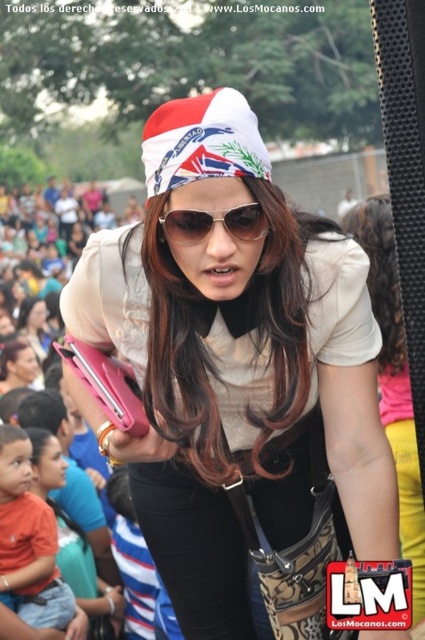
Question: Does white matte bandana at center appear over matte black phone at center?

Choices:
 (A) no
 (B) yes

Answer: (A)

Question: Is white matte bandana at center thinner than sunglasses at center?

Choices:
 (A) no
 (B) yes

Answer: (B)

Question: Can you confirm if white matte shirt at center is positioned above matte black phone at center?

Choices:
 (A) yes
 (B) no

Answer: (B)

Question: Among these objects, which one is nearest to the camera?

Choices:
 (A) matte black phone at center
 (B) white matte bandana at center

Answer: (B)

Question: Which object is positioned farthest from the white matte shirt at center?

Choices:
 (A) white matte bandana at center
 (B) sunglasses at center

Answer: (A)

Question: Which object appears farthest from the camera in this image?

Choices:
 (A) matte black phone at center
 (B) white matte shirt at center
 (C) sunglasses at center
 (D) white matte bandana at center

Answer: (A)